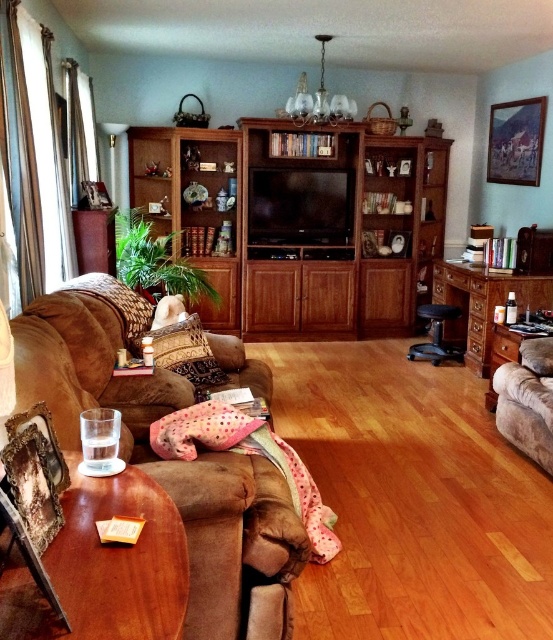
Question: Which object appears farthest from the camera in this image?

Choices:
 (A) suede couch at left
 (B) black leather stool at center
 (C) brown textured pillow at center

Answer: (B)

Question: Which object is positioned closest to the suede armchair at right?

Choices:
 (A) black leather stool at center
 (B) wooden entertainment center at center

Answer: (A)

Question: Which object is the closest to the brown textured pillow at center?

Choices:
 (A) black leather stool at center
 (B) suede armchair at right
 (C) suede couch at left
 (D) wooden entertainment center at center

Answer: (C)

Question: Observing the image, what is the correct spatial positioning of wooden entertainment center at center in reference to suede couch at left?

Choices:
 (A) below
 (B) above

Answer: (B)

Question: From the image, what is the correct spatial relationship of wooden entertainment center at center in relation to suede couch at left?

Choices:
 (A) below
 (B) above

Answer: (B)

Question: Does suede couch at left come behind suede armchair at right?

Choices:
 (A) yes
 (B) no

Answer: (B)